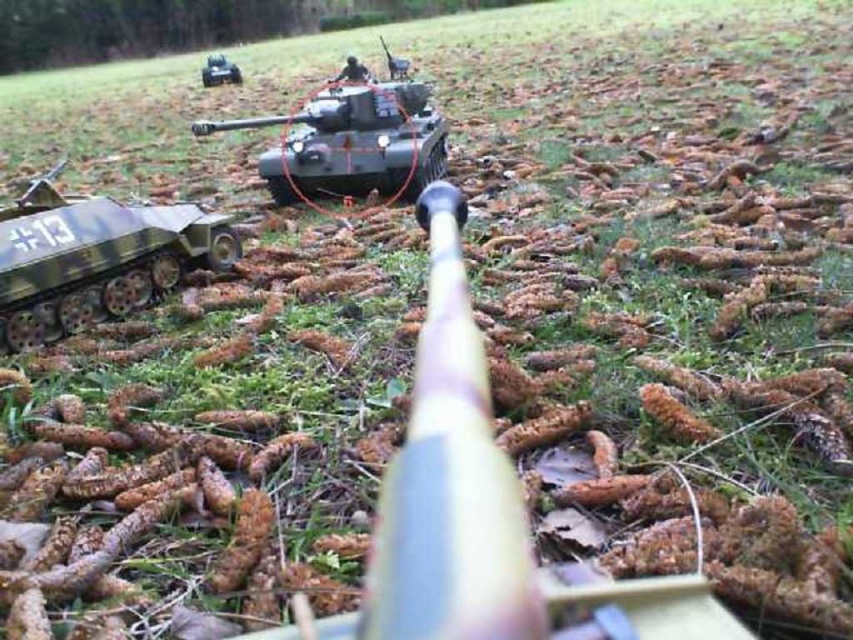
You are a soldier in a miniature military simulation. You need to determine which of the two points, point (x=223, y=218) or point (x=228, y=74), is closer to you. Based on the scene, which point is nearer?

Point (x=223, y=218) is closer to the viewer than point (x=228, y=74).

You are a soldier in a military simulation and need to determine if you can see the point marked at coordinates point (233, 240) through your rifle scope. The minimum focus distance of your scope is 3.5 meters. Can you focus on this point?

The distance of point (233, 240) from camera is 3.90 meters, which is beyond the minimum focus distance of 3.5 meters. Therefore, you can focus on this point.